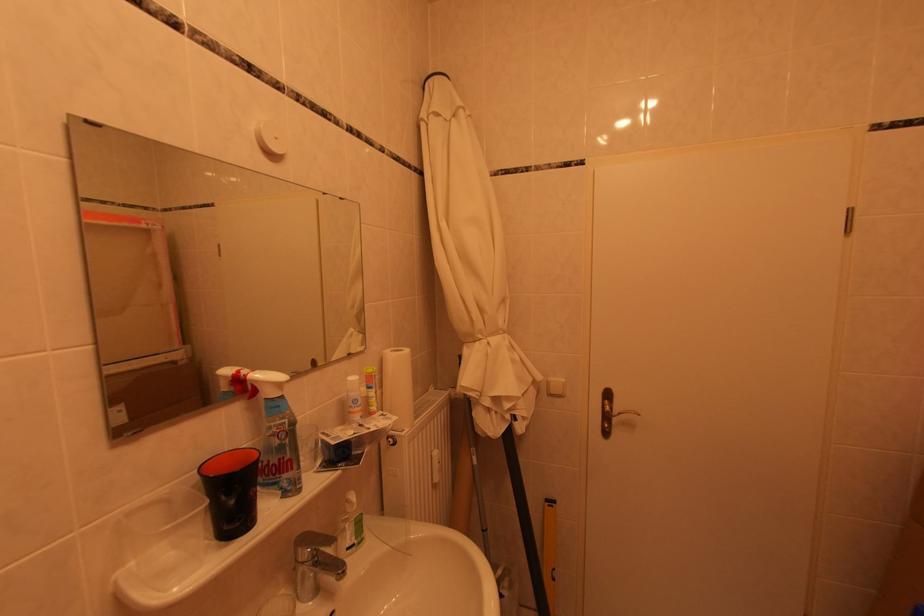
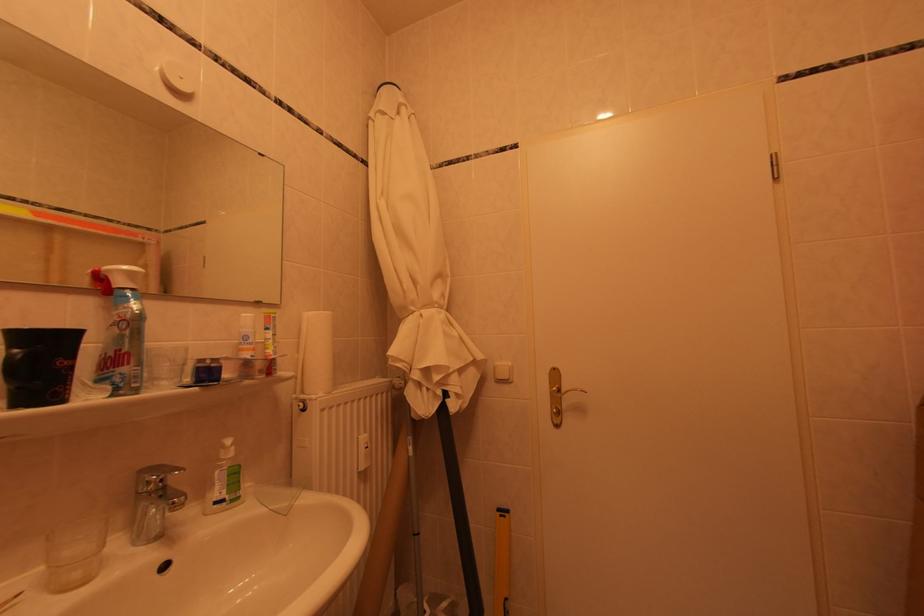
Locate, in the second image, the point that corresponds to point 301,472 in the first image.

(138, 368)